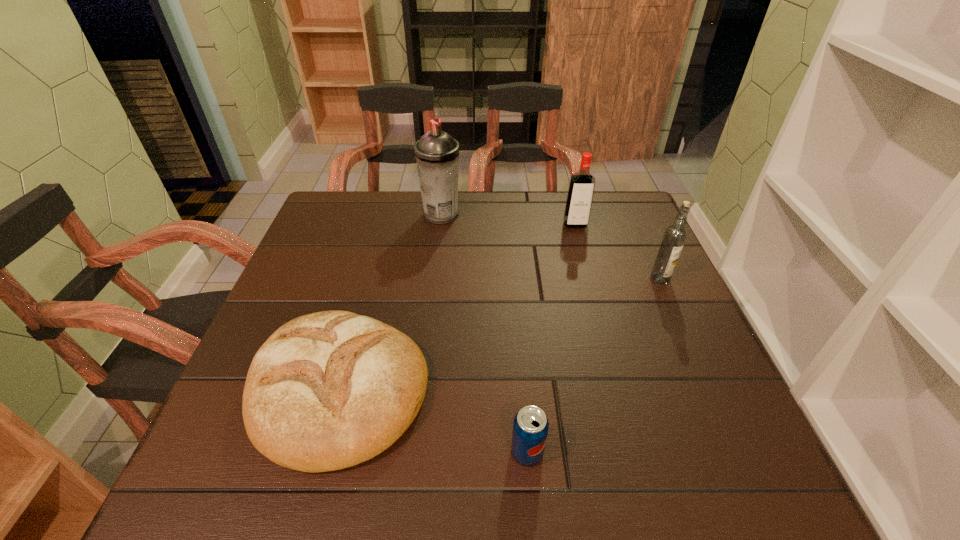
The image size is (960, 540). In order to click on vacant area between the aerosol can and the bread in this screenshot , I will do `click(391, 301)`.

This screenshot has height=540, width=960. What are the coordinates of `free space between the bread and the tallest object` in the screenshot? It's located at (391, 301).

Locate an element on the screen. empty location between the bread and the second object from right to left is located at coordinates (457, 306).

Where is `vacant area that lies between the third object from right to left and the left vodka`? vacant area that lies between the third object from right to left and the left vodka is located at coordinates (551, 338).

Find the location of a particular element. The height and width of the screenshot is (540, 960). vacant area that lies between the third object from right to left and the second object from right to left is located at coordinates (551, 338).

The height and width of the screenshot is (540, 960). Find the location of `object that can be found as the closest to the left vodka`. object that can be found as the closest to the left vodka is located at coordinates (674, 237).

Find the location of a particular element. The width and height of the screenshot is (960, 540). the fourth closest object to the third object from right to left is located at coordinates (437, 153).

Find the location of a particular element. vacant area in the image that satisfies the following two spatial constraints: 1. on the front side of the bread; 2. on the left side of the pop soda is located at coordinates (322, 452).